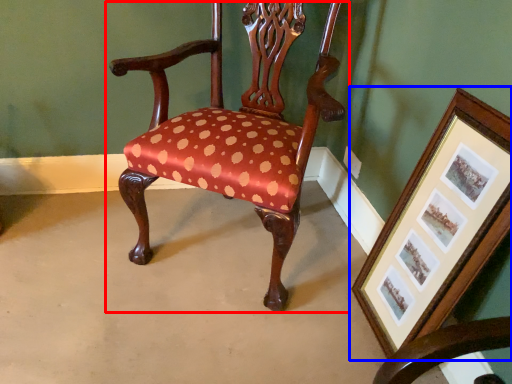
Question: Which object appears closest to the camera in this image, chair (highlighted by a red box) or picture frame (highlighted by a blue box)?

Choices:
 (A) chair
 (B) picture frame

Answer: (B)